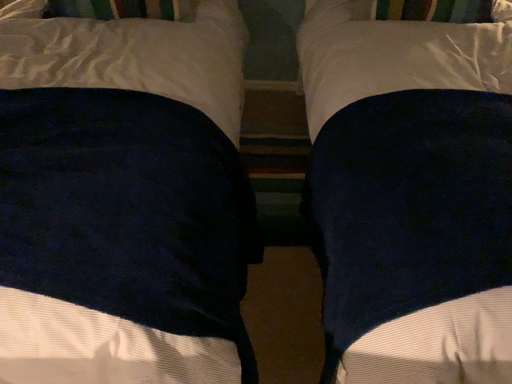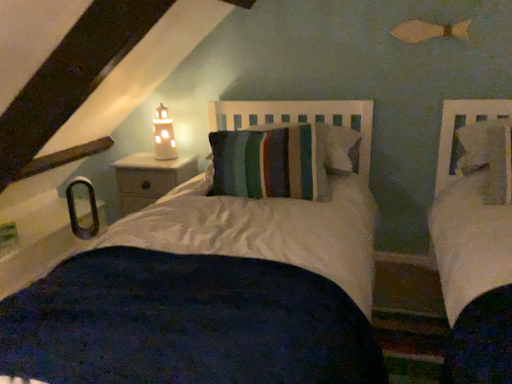
Question: How did the camera likely rotate when shooting the video?

Choices:
 (A) rotated right
 (B) rotated left

Answer: (B)